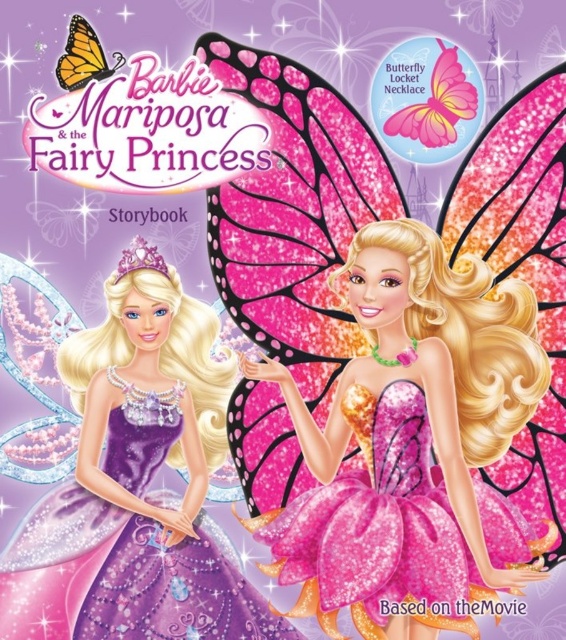
You are a fashion designer who needs to decide which dress to display in a window mannequin. The mannequin stand is 60 cm tall. Which dress, the pink glitter dress at center or the purple satin dress at left, would be more suitable for the display?

The pink glitter dress at center is shorter than the purple satin dress at left, so the pink glitter dress at center would be more suitable for the display as it is shorter and less likely to drag on the mannequin stand.

Looking at the storybook cover, there are two dresses shown. The pink glitter dress at center and the purple satin dress at left. Which dress is positioned lower in the image?

The pink glitter dress at center is below the purple satin dress at left, so it is positioned lower in the image.

You are designing a display stand for the storybook cover. The stand has two slots for the characters. The slot for the pink glitter dress at center must be narrower than the slot for the purple satin dress at left. Is this requirement met based on the image?

The pink glitter dress at center has a width less than the purple satin dress at left, so the requirement is met as the slot for the pink glitter dress at center can be narrower than the slot for the purple satin dress at left.